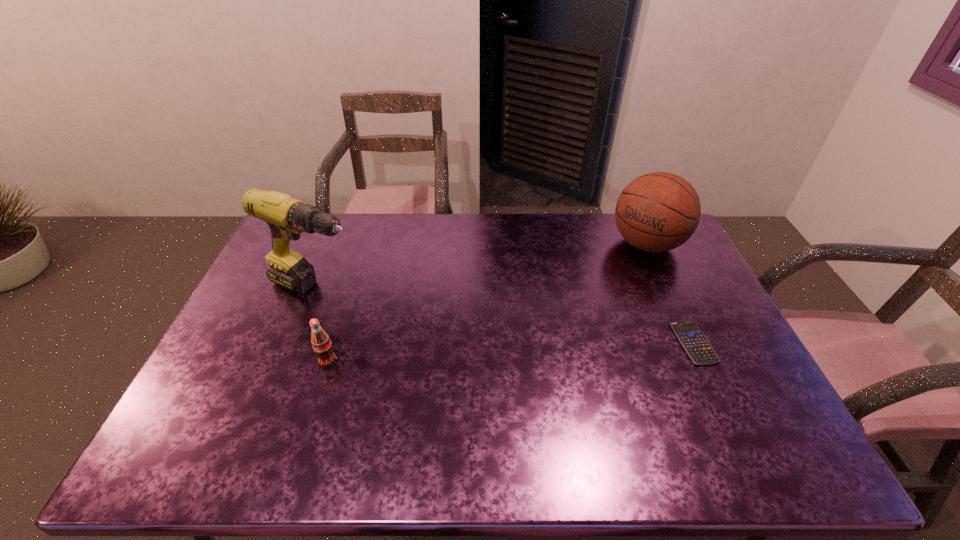
Where is `the third tallest object`? the third tallest object is located at coordinates (321, 343).

At what (x,y) coordinates should I click in order to perform the action: click on calculator. Please return your answer as a coordinate pair (x, y). This screenshot has width=960, height=540. Looking at the image, I should click on (693, 340).

I want to click on the third nearest object, so click(x=287, y=217).

Where is `drill`? Image resolution: width=960 pixels, height=540 pixels. drill is located at coordinates (287, 217).

Find the location of a particular element. The width and height of the screenshot is (960, 540). basketball is located at coordinates (657, 212).

The image size is (960, 540). Identify the location of the second tallest object. (657, 212).

You are a GUI agent. You are given a task and a screenshot of the screen. Output one action in this format:
    pyautogui.click(x=<x>, y=<y>)
    Task: Click on the free spot located on the left of the second shortest object
    The image size is (960, 540).
    Given the screenshot: What is the action you would take?
    pyautogui.click(x=286, y=362)

In order to click on free region located on the left of the shortest object in this screenshot , I will do 564,342.

Identify the location of vacant region located 0.080m on the handle side of the tallest object. The image size is (960, 540). (380, 306).

Where is `free space located 0.260m on the handle side of the tallest object`? This screenshot has height=540, width=960. free space located 0.260m on the handle side of the tallest object is located at coordinates (431, 326).